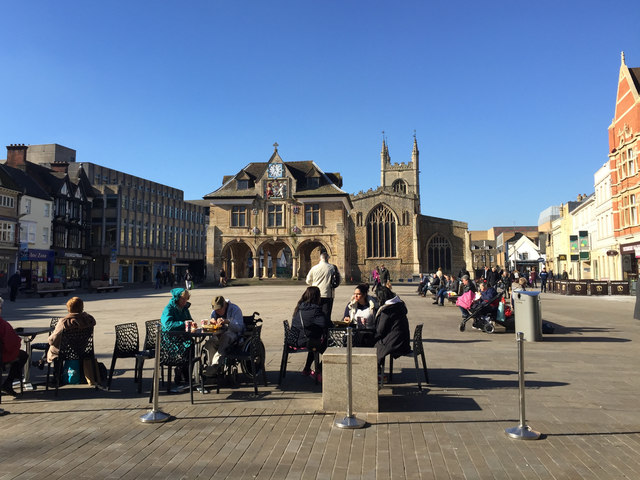
This screenshot has height=480, width=640. In order to click on arch way in this screenshot , I will do `click(443, 242)`, `click(381, 217)`, `click(401, 186)`, `click(305, 244)`, `click(269, 248)`, `click(232, 249)`.